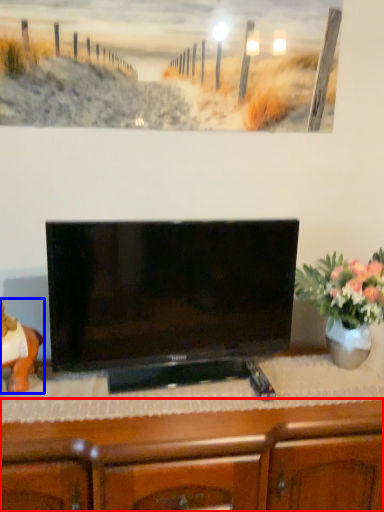
Question: Among these objects, which one is nearest to the camera, cabinetry (highlighted by a red box) or animal (highlighted by a blue box)?

Choices:
 (A) cabinetry
 (B) animal

Answer: (A)